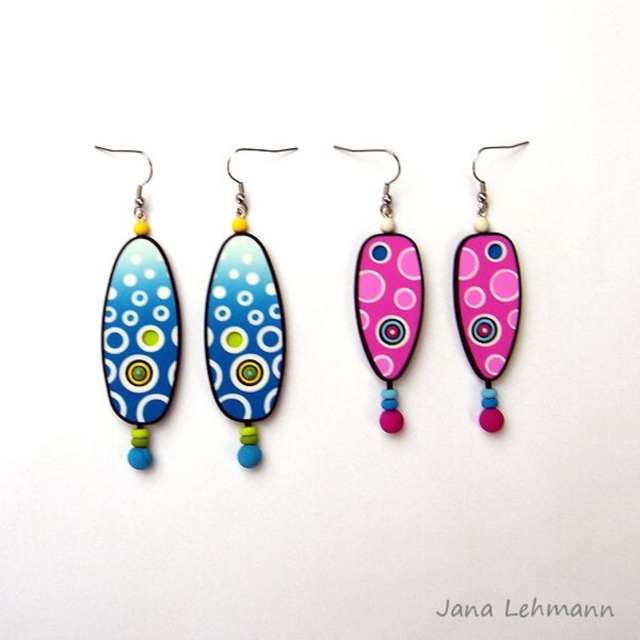
Which is below, blue glossy oval at center or pink glossy teardrop at center?

blue glossy oval at center is below.

Image resolution: width=640 pixels, height=640 pixels. Describe the element at coordinates (244, 326) in the screenshot. I see `blue glossy oval at center` at that location.

Identify the location of blue glossy oval at center. The height and width of the screenshot is (640, 640). (244, 326).

Does blue glossy oval at center have a larger size compared to pink glossy earring at center?

Yes.

Which is in front, point (216, 385) or point (413, 266)?

Point (216, 385) is in front.

Which is behind, point (221, 404) or point (406, 352)?

The point (406, 352) is more distant.

Where is `blue glossy oval at center`? Image resolution: width=640 pixels, height=640 pixels. blue glossy oval at center is located at coordinates (244, 326).

Can you confirm if pink glossy earring at center is shorter than pink glossy teardrop at center?

Incorrect, pink glossy earring at center's height does not fall short of pink glossy teardrop at center's.

Which is behind, point (394, 253) or point (502, 333)?

Point (394, 253)

This screenshot has width=640, height=640. Find the location of `pink glossy earring at center`. pink glossy earring at center is located at coordinates (387, 300).